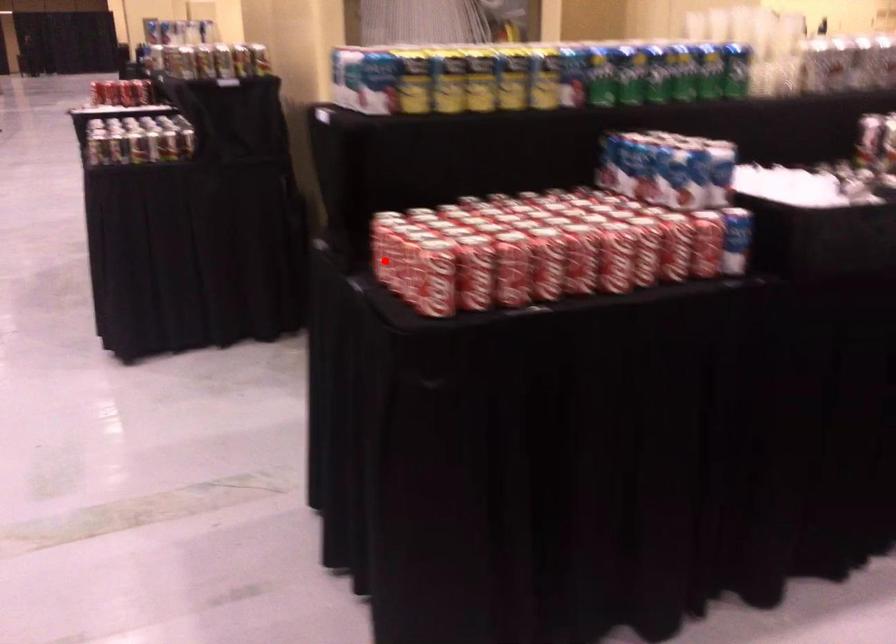
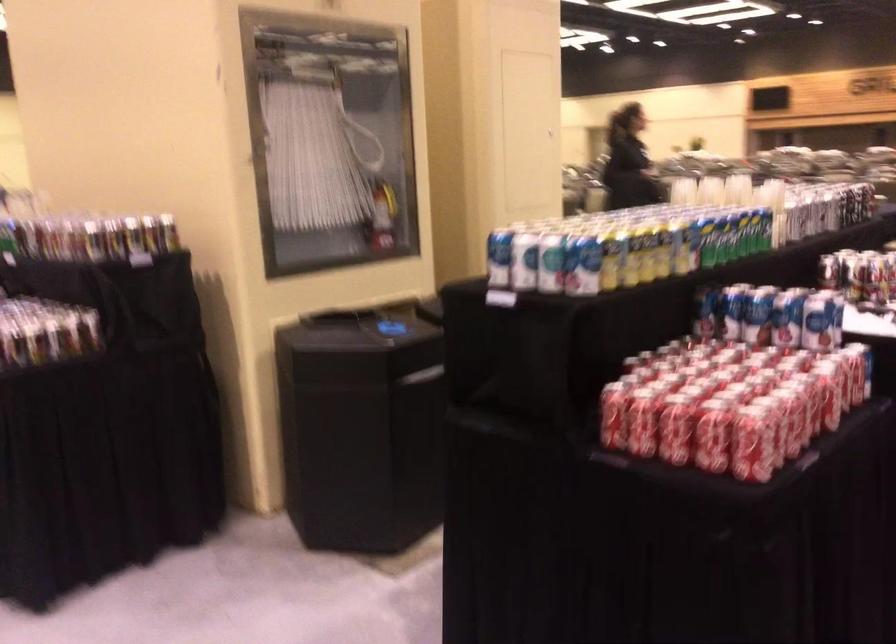
Where in the second image is the point corresponding to the highlighted location from the first image?

(674, 430)